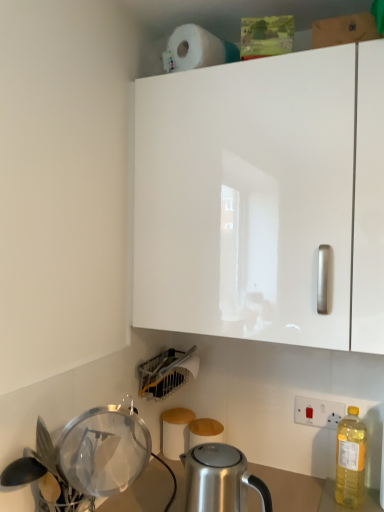
Question: Considering the relative sizes of matte plastic dish rack at lower center, the second appliance from the front, and white glossy cabinet at upper center in the image provided, is matte plastic dish rack at lower center, the second appliance from the front, smaller than white glossy cabinet at upper center?

Choices:
 (A) no
 (B) yes

Answer: (B)

Question: Considering the relative sizes of matte plastic dish rack at lower center, the second appliance from the front, and white glossy cabinet at upper center in the image provided, is matte plastic dish rack at lower center, the second appliance from the front, thinner than white glossy cabinet at upper center?

Choices:
 (A) no
 (B) yes

Answer: (B)

Question: Does matte plastic dish rack at lower center, the second appliance from the front, contain white glossy cabinet at upper center?

Choices:
 (A) yes
 (B) no

Answer: (B)

Question: From the image's perspective, is matte plastic dish rack at lower center, the second appliance from the front, beneath white glossy cabinet at upper center?

Choices:
 (A) yes
 (B) no

Answer: (A)

Question: Does matte plastic dish rack at lower center, the second appliance from the front, appear on the left side of white glossy cabinet at upper center?

Choices:
 (A) no
 (B) yes

Answer: (B)

Question: Does matte plastic dish rack at lower center, the second appliance from the front, have a greater width compared to white glossy cabinet at upper center?

Choices:
 (A) yes
 (B) no

Answer: (B)

Question: Is white matte paper towel at upper center wider than satin silver kettle at lower center?

Choices:
 (A) no
 (B) yes

Answer: (A)

Question: Is white matte paper towel at upper center facing away from satin silver kettle at lower center?

Choices:
 (A) no
 (B) yes

Answer: (A)

Question: Does white matte paper towel at upper center contain satin silver kettle at lower center?

Choices:
 (A) yes
 (B) no

Answer: (B)

Question: Could you tell me if white matte paper towel at upper center is facing satin silver kettle at lower center?

Choices:
 (A) no
 (B) yes

Answer: (A)

Question: From the image's perspective, would you say white matte paper towel at upper center is shown under satin silver kettle at lower center?

Choices:
 (A) no
 (B) yes

Answer: (A)

Question: Is white matte paper towel at upper center completely or partially outside of satin silver kettle at lower center?

Choices:
 (A) no
 (B) yes

Answer: (B)

Question: Considering the relative sizes of matte plastic dish rack at lower center, which ranks as the first appliance in back-to-front order, and white matte paper towel at upper center in the image provided, is matte plastic dish rack at lower center, which ranks as the first appliance in back-to-front order, bigger than white matte paper towel at upper center?

Choices:
 (A) yes
 (B) no

Answer: (A)